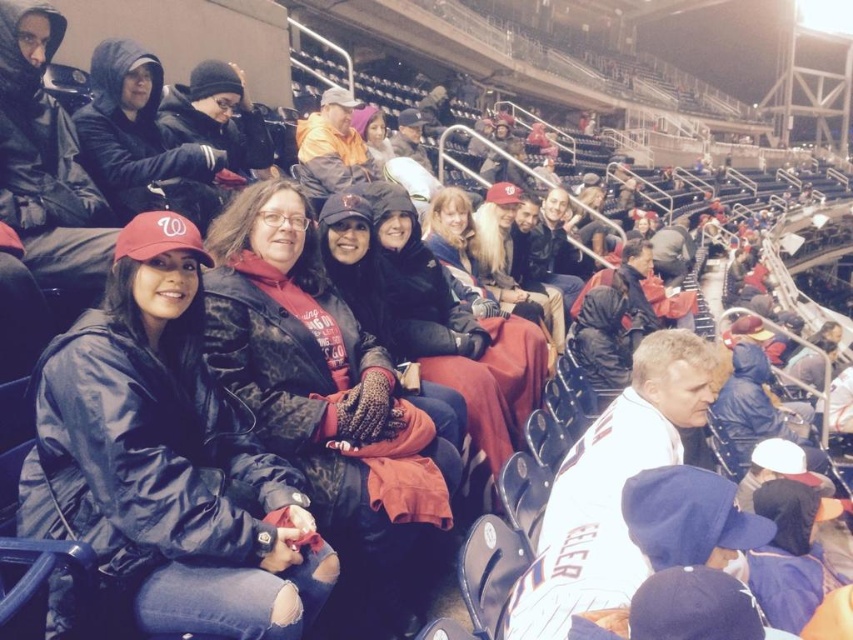
You are a photographer at the stadium and want to capture both the camouflage jacket at center and the matte black jacket at upper left in the same frame. Which jacket should you position your camera closer to in order to include both?

You should position your camera closer to the matte black jacket at upper left since the camouflage jacket at center is to the right of it, allowing both jackets to be captured in the frame when centered on the left jacket.

You are a photographer standing at the center of the stadium. You want to take a photo of the matte black jacket at left. Where should you aim your camera?

You should aim your camera at point (166, 458) to capture the matte black jacket at left.